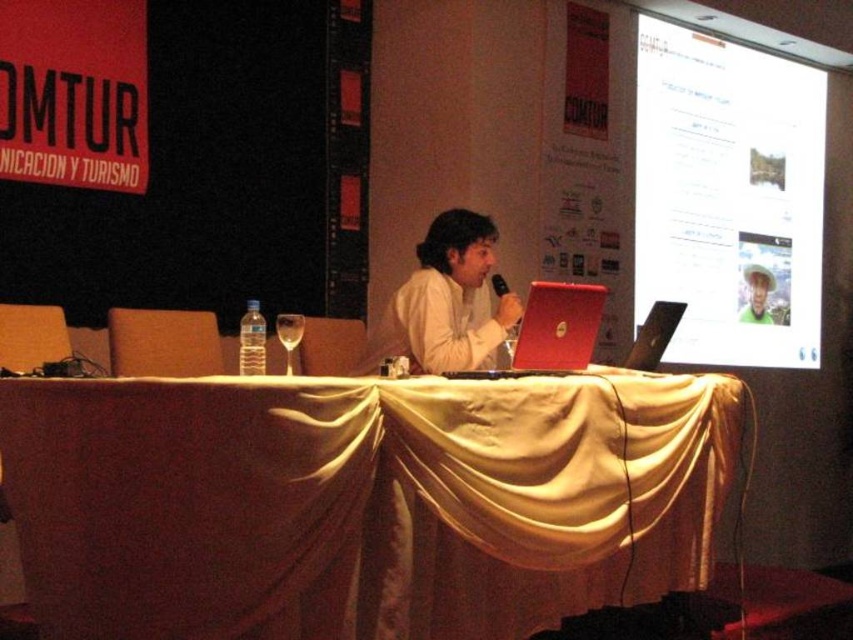
Does white glossy screen at upper right have a larger size compared to red matte laptop at center?

Indeed, white glossy screen at upper right has a larger size compared to red matte laptop at center.

Can you confirm if white glossy screen at upper right is positioned above red matte laptop at center?

Yes, white glossy screen at upper right is above red matte laptop at center.

Who is more forward, [659,220] or [527,323]?

Point [527,323] is in front.

This screenshot has height=640, width=853. I want to click on white glossy screen at upper right, so [728, 195].

Does point (502, 282) come behind point (494, 292)?

No, it is not.

Between red matte laptop at center and black plastic microphone at center, which one appears on the left side from the viewer's perspective?

From the viewer's perspective, red matte laptop at center appears more on the left side.

Is point (569, 337) farther from camera compared to point (502, 284)?

No, (569, 337) is in front of (502, 284).

Identify the location of red matte laptop at center. This screenshot has height=640, width=853. (550, 330).

Which of these two, white satin table at center or white matte shirt at center, stands shorter?

Standing shorter between the two is white matte shirt at center.

Measure the distance between point (556, 451) and camera.

They are 2.75 meters apart.

Identify the location of white satin table at center. Image resolution: width=853 pixels, height=640 pixels. (361, 500).